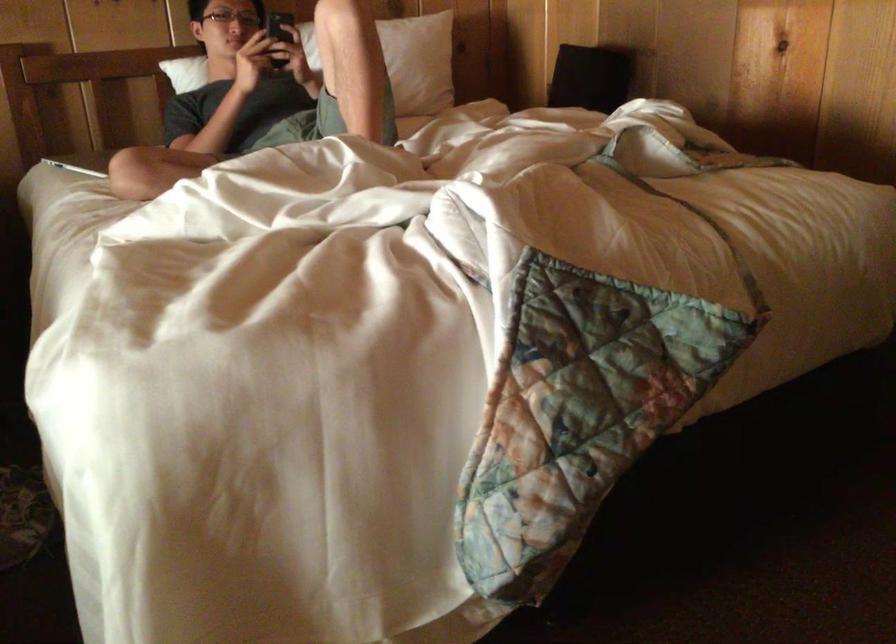
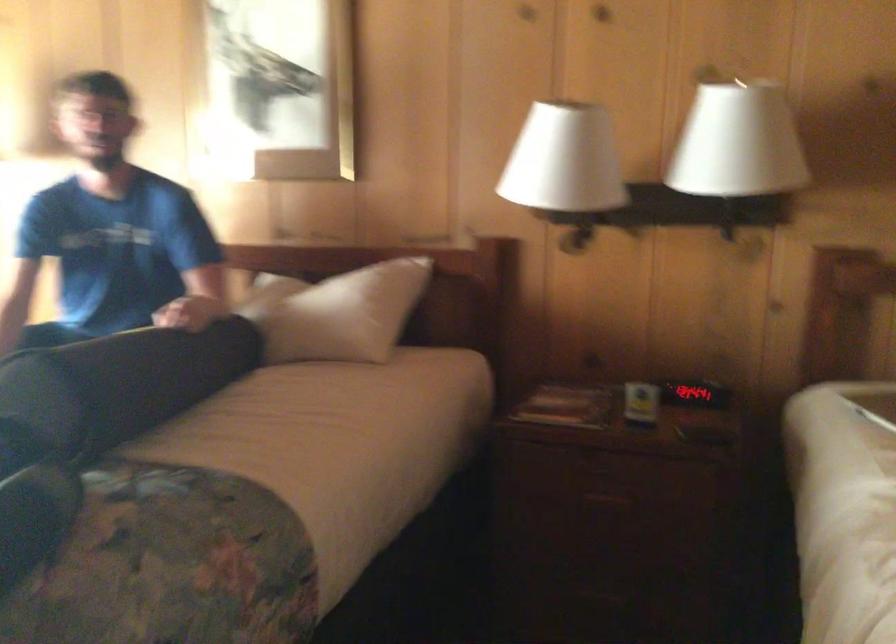
Question: The first image is from the beginning of the video and the second image is from the end. How did the camera likely rotate when shooting the video?

Choices:
 (A) Left
 (B) Right
 (C) Up
 (D) Down

Answer: (A)